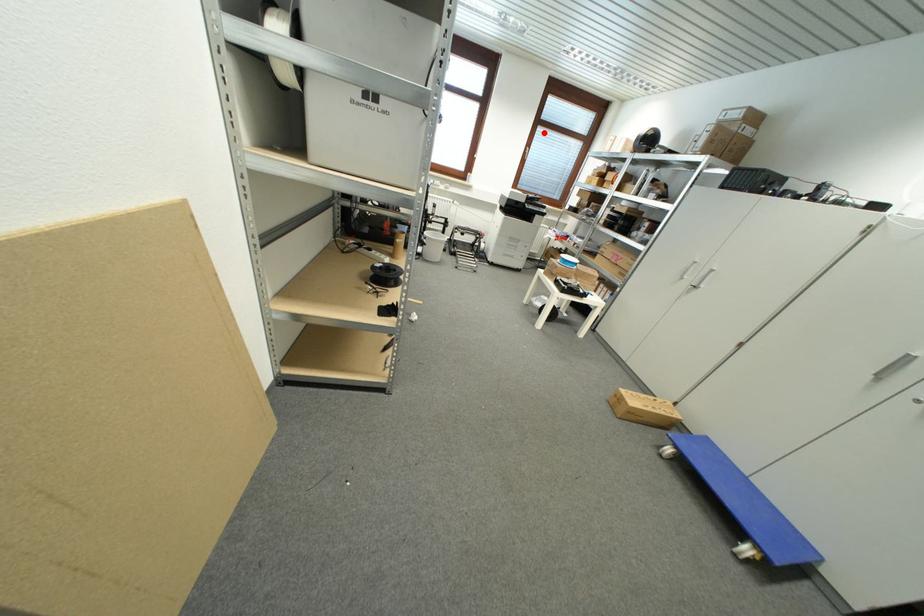
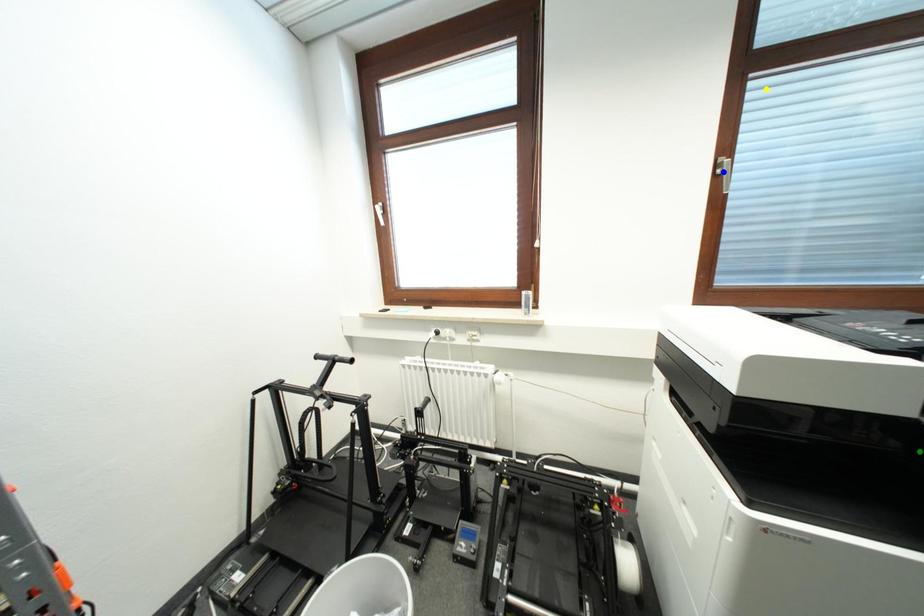
Question: I am providing you with two images of the same scene from different viewpoints. A red point is marked on the first image. You are given multiple points on the second image. Which mark in image 2 goes with the point in image 1?

Choices:
 (A) green point
 (B) blue point
 (C) yellow point

Answer: (C)